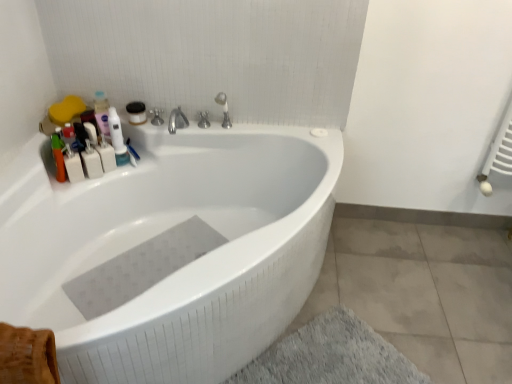
Question: Which direction should I rotate to look at satin nickel faucet at upper center, the first tap from the right, — up or down?

Choices:
 (A) down
 (B) up

Answer: (B)

Question: Is the position of white plastic mouthwash at upper left, positioned as the 2th mouthwash in right-to-left order, less distant than that of gray rubber mat at bottom?

Choices:
 (A) no
 (B) yes

Answer: (A)

Question: Does white plastic mouthwash at upper left, positioned as the 2th mouthwash in right-to-left order, have a smaller size compared to gray rubber mat at bottom?

Choices:
 (A) yes
 (B) no

Answer: (A)

Question: Does white plastic mouthwash at upper left, which ranks as the first mouthwash in left-to-right order, have a greater width compared to gray rubber mat at bottom?

Choices:
 (A) no
 (B) yes

Answer: (A)

Question: Is white plastic mouthwash at upper left, positioned as the 2th mouthwash in right-to-left order, taller than gray rubber mat at bottom?

Choices:
 (A) yes
 (B) no

Answer: (A)

Question: Is white plastic mouthwash at upper left, positioned as the 2th mouthwash in right-to-left order, oriented away from gray rubber mat at bottom?

Choices:
 (A) yes
 (B) no

Answer: (B)

Question: Is white plastic mouthwash at upper left, positioned as the 2th mouthwash in right-to-left order, thinner than gray rubber mat at bottom?

Choices:
 (A) no
 (B) yes

Answer: (B)

Question: Is white glossy bottle at upper left at the left side of white plastic bottles at upper left?

Choices:
 (A) no
 (B) yes

Answer: (A)

Question: Does white glossy bottle at upper left come behind white plastic bottles at upper left?

Choices:
 (A) yes
 (B) no

Answer: (A)

Question: Are white glossy bottle at upper left and white plastic bottles at upper left located far from each other?

Choices:
 (A) no
 (B) yes

Answer: (A)

Question: Does white glossy bottle at upper left have a lesser width compared to white plastic bottles at upper left?

Choices:
 (A) yes
 (B) no

Answer: (B)

Question: Can you confirm if white glossy bottle at upper left is wider than white plastic bottles at upper left?

Choices:
 (A) yes
 (B) no

Answer: (A)

Question: Considering the relative sizes of white glossy bottle at upper left and white plastic bottles at upper left in the image provided, is white glossy bottle at upper left taller than white plastic bottles at upper left?

Choices:
 (A) yes
 (B) no

Answer: (A)

Question: Does polished chrome faucet at upper center, placed as the first tap when sorted from left to right, turn towards white glossy bathtub at upper center?

Choices:
 (A) yes
 (B) no

Answer: (A)